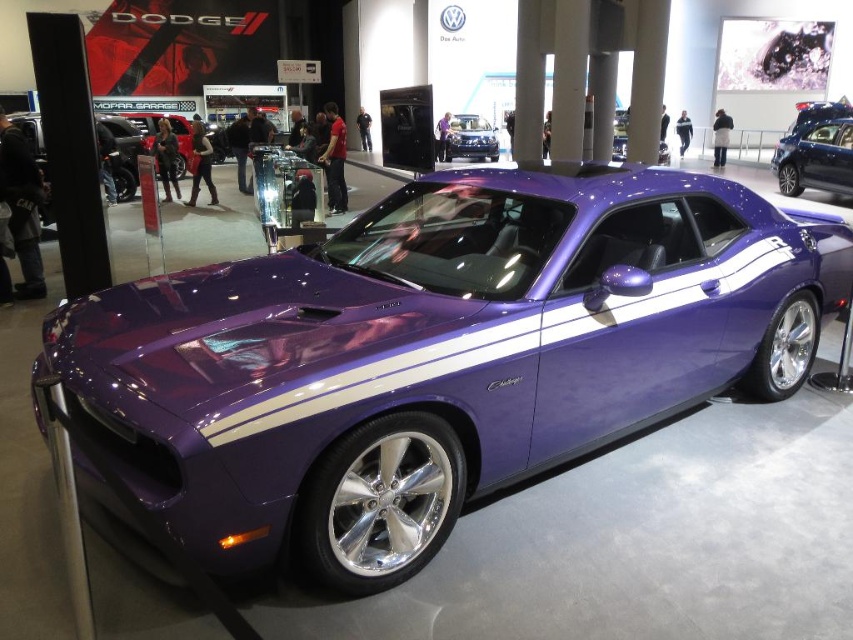
You are an auto show attendee standing in front of the shiny purple car at center and the glossy purple car at center. Which car is located higher up?

The shiny purple car at center is positioned under the glossy purple car at center, so the glossy purple car at center is higher up.

You are standing in front of the purple Dodge Challenger R T at an auto show. You notice two points marked on the car. The first point is at coordinate (825, 141) and the second point is at coordinate (489, 157). From your perspective, which point is closer to you?

Point (825, 141) is in front of point (489, 157), so it is closer to you.

You are standing at the entrance of the auto show and want to take a photo of the shiny purple car at center. The auto show has a rule that you must stand exactly at point 0.555, 0.512 to take the photo. Can you confirm if you are positioned correctly?

Yes, you are positioned correctly at point (436, 355) to take the photo of the shiny purple car at center.